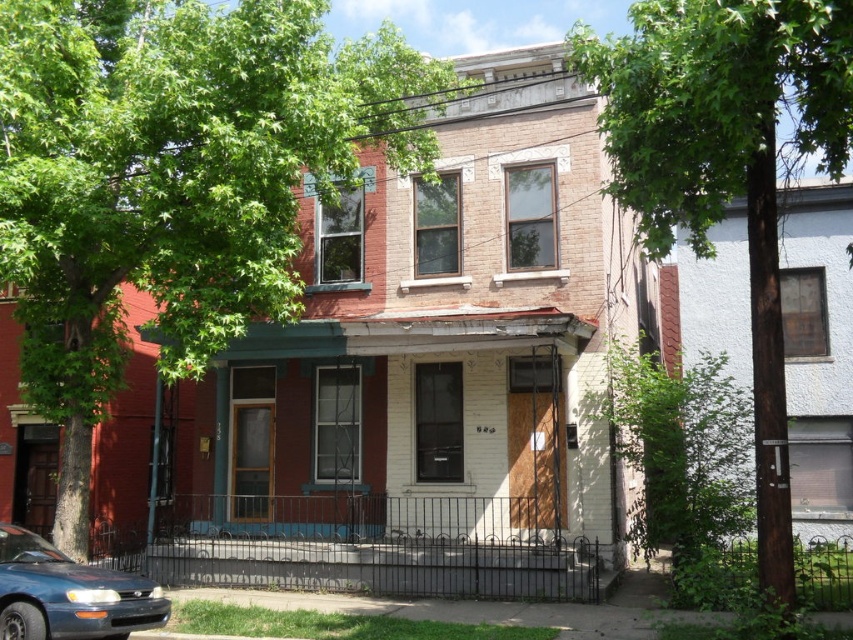
In the scene shown: Which is above, green leafy tree at upper left or green leafy tree at center?

green leafy tree at center is higher up.

Based on the photo, does green leafy tree at upper left appear under green leafy tree at center?

Yes, green leafy tree at upper left is below green leafy tree at center.

Between point (96, 400) and point (675, 92), which one is positioned behind?

The point (96, 400) is more distant.

Locate an element on the screen. green leafy tree at upper left is located at coordinates (173, 180).

Does green leafy tree at center have a lesser height compared to matte blue sedan at lower left?

Yes.

In order to click on green leafy tree at center in this screenshot , I will do `click(727, 168)`.

Does green leafy tree at upper left have a greater height compared to matte blue sedan at lower left?

No.

Can you confirm if green leafy tree at upper left is positioned to the right of matte blue sedan at lower left?

No, green leafy tree at upper left is not to the right of matte blue sedan at lower left.

You are a GUI agent. You are given a task and a screenshot of the screen. Output one action in this format:
    pyautogui.click(x=<x>, y=<y>)
    Task: Click on the green leafy tree at upper left
    The height and width of the screenshot is (640, 853).
    Given the screenshot: What is the action you would take?
    pyautogui.click(x=173, y=180)